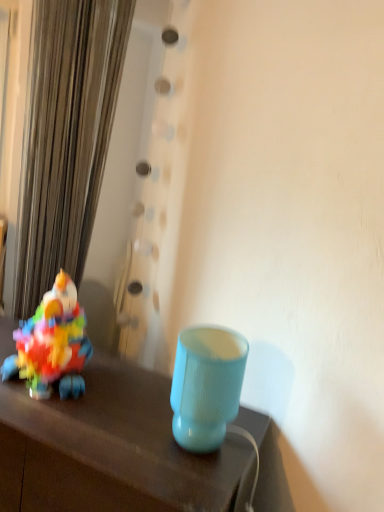
Image resolution: width=384 pixels, height=512 pixels. What are the coordinates of `metallic silver curtain at left` in the screenshot? It's located at 66,137.

The height and width of the screenshot is (512, 384). What do you see at coordinates (52, 344) in the screenshot? I see `multicolored plastic toy at left` at bounding box center [52, 344].

The width and height of the screenshot is (384, 512). What are the coordinates of `metallic silver curtain at left` in the screenshot? It's located at (66, 137).

The width and height of the screenshot is (384, 512). I want to click on table lamp that is under the metallic silver curtain at left (from a real-world perspective), so click(x=206, y=385).

From the image's perspective, which one is positioned lower, metallic silver curtain at left or matte blue lampshade at center?

matte blue lampshade at center, from the image's perspective.

Between metallic silver curtain at left and matte blue lampshade at center, which one is positioned behind?

metallic silver curtain at left is more distant.

Does matte blue lampshade at center touch metallic silver curtain at left?

No, matte blue lampshade at center is not making contact with metallic silver curtain at left.

Looking at this image, in terms of height, does matte blue lampshade at center look taller or shorter compared to metallic silver curtain at left?

Clearly, matte blue lampshade at center is shorter compared to metallic silver curtain at left.

Between matte blue lampshade at center and metallic silver curtain at left, which one appears on the left side from the viewer's perspective?

metallic silver curtain at left is more to the left.

This screenshot has width=384, height=512. In order to click on table lamp located below the metallic silver curtain at left (from the image's perspective) in this screenshot , I will do `click(206, 385)`.

This screenshot has height=512, width=384. Find the location of `table lamp located above the matte plastic lamp at lower right (from a real-world perspective)`. table lamp located above the matte plastic lamp at lower right (from a real-world perspective) is located at coordinates (206, 385).

Is matte plastic lamp at lower right wider than matte blue lampshade at center?

Indeed, matte plastic lamp at lower right has a greater width compared to matte blue lampshade at center.

Which of these two, matte plastic lamp at lower right or matte blue lampshade at center, is smaller?

With smaller size is matte blue lampshade at center.

Based on the photo, is metallic silver curtain at left beside matte plastic lamp at lower right?

metallic silver curtain at left and matte plastic lamp at lower right are not in contact.

Is metallic silver curtain at left closer to the viewer compared to matte plastic lamp at lower right?

No, it is not.

Consider the image. Could you tell me if metallic silver curtain at left is facing matte plastic lamp at lower right?

No, metallic silver curtain at left is not oriented towards matte plastic lamp at lower right.

In the image, is multicolored plastic toy at left positioned in front of or behind metallic silver curtain at left?

Visually, multicolored plastic toy at left is located in front of metallic silver curtain at left.

Which of these two, multicolored plastic toy at left or metallic silver curtain at left, is wider?

multicolored plastic toy at left.

Is point (37, 312) closer or farther from the camera than point (79, 41)?

Point (37, 312).

From a real-world perspective, between matte plastic lamp at lower right and metallic silver curtain at left, who is vertically lower?

matte plastic lamp at lower right, from a real-world perspective.

Which object is positioned more to the right, matte plastic lamp at lower right or metallic silver curtain at left?

matte plastic lamp at lower right is more to the right.

Is metallic silver curtain at left surrounded by matte plastic lamp at lower right?

No, metallic silver curtain at left is located outside of matte plastic lamp at lower right.

Can you confirm if multicolored plastic toy at left is wider than matte plastic lamp at lower right?

No, multicolored plastic toy at left is not wider than matte plastic lamp at lower right.

From the image's perspective, does multicolored plastic toy at left appear higher than matte plastic lamp at lower right?

Yes, from the image's perspective, multicolored plastic toy at left is over matte plastic lamp at lower right.

Are multicolored plastic toy at left and matte plastic lamp at lower right beside each other?

multicolored plastic toy at left and matte plastic lamp at lower right are clearly separated.

Find the location of `table lamp below the metallic silver curtain at left (from the image's perspective)`. table lamp below the metallic silver curtain at left (from the image's perspective) is located at coordinates (206, 385).

This screenshot has width=384, height=512. In order to click on curtain above the matte blue lampshade at center (from a real-world perspective) in this screenshot , I will do `click(66, 137)`.

Considering their positions, is multicolored plastic toy at left positioned closer to metallic silver curtain at left than matte plastic lamp at lower right?

multicolored plastic toy at left.

When comparing their distances from matte blue lampshade at center, does matte plastic lamp at lower right or multicolored plastic toy at left seem further?

Based on the image, multicolored plastic toy at left appears to be further to matte blue lampshade at center.

When comparing their distances from matte plastic lamp at lower right, does metallic silver curtain at left or matte blue lampshade at center seem closer?

matte blue lampshade at center lies closer to matte plastic lamp at lower right than the other object.

From the image, which object appears to be nearer to matte blue lampshade at center, matte plastic lamp at lower right or metallic silver curtain at left?

Among the two, matte plastic lamp at lower right is located nearer to matte blue lampshade at center.

From the image, which object appears to be nearer to metallic silver curtain at left, matte blue lampshade at center or multicolored plastic toy at left?

multicolored plastic toy at left lies closer to metallic silver curtain at left than the other object.

Estimate the real-world distances between objects in this image. Which object is closer to matte blue lampshade at center, metallic silver curtain at left or matte plastic lamp at lower right?

Based on the image, matte plastic lamp at lower right appears to be nearer to matte blue lampshade at center.

In the scene shown: Looking at the image, which one is located closer to multicolored plastic toy at left, matte blue lampshade at center or matte plastic lamp at lower right?

matte plastic lamp at lower right is positioned closer to the anchor multicolored plastic toy at left.

Considering their positions, is multicolored plastic toy at left positioned further to matte blue lampshade at center than metallic silver curtain at left?

metallic silver curtain at left is further to matte blue lampshade at center.

I want to click on table lamp between metallic silver curtain at left and matte plastic lamp at lower right in the vertical direction, so pyautogui.click(x=206, y=385).

You are a GUI agent. You are given a task and a screenshot of the screen. Output one action in this format:
    pyautogui.click(x=<x>, y=<y>)
    Task: Click on the table lamp that lies between multicolored plastic toy at left and matte plastic lamp at lower right from top to bottom
    The height and width of the screenshot is (512, 384).
    Given the screenshot: What is the action you would take?
    pyautogui.click(x=206, y=385)

Where is `toy between metallic silver curtain at left and matte plastic lamp at lower right from top to bottom`? toy between metallic silver curtain at left and matte plastic lamp at lower right from top to bottom is located at coordinates (52, 344).

Locate an element on the screen. The width and height of the screenshot is (384, 512). toy between metallic silver curtain at left and matte blue lampshade at center from top to bottom is located at coordinates tap(52, 344).